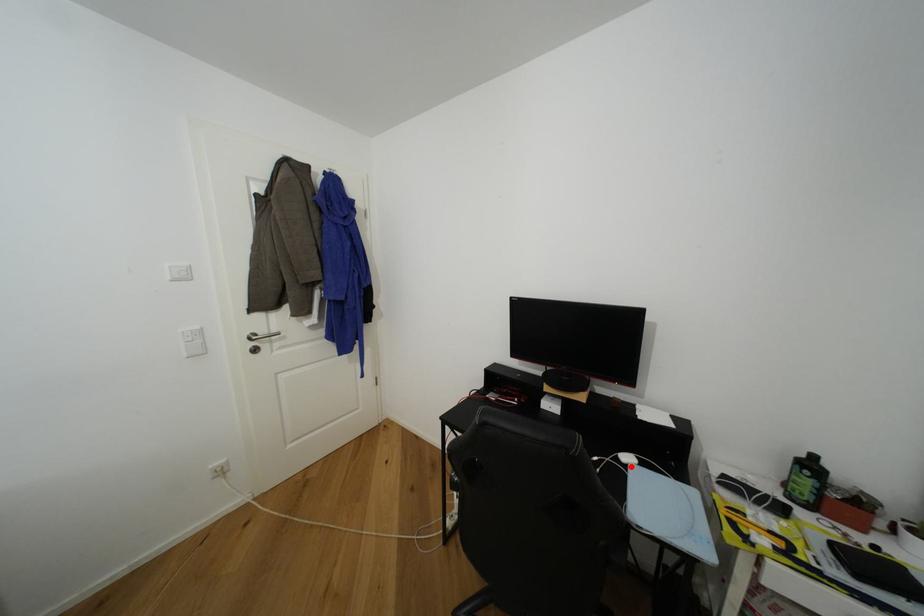
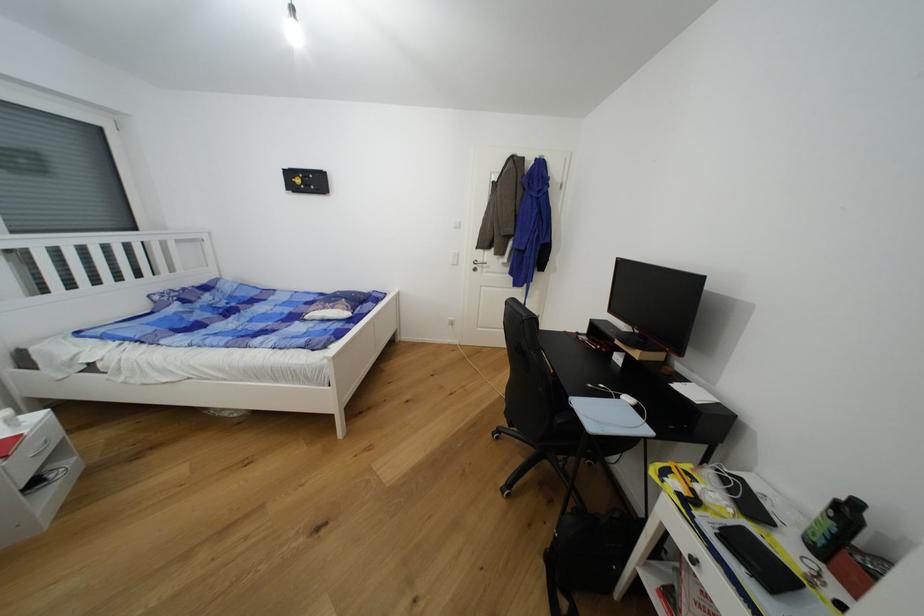
In the second image, find the point that corresponds to the highlighted location in the first image.

(623, 399)